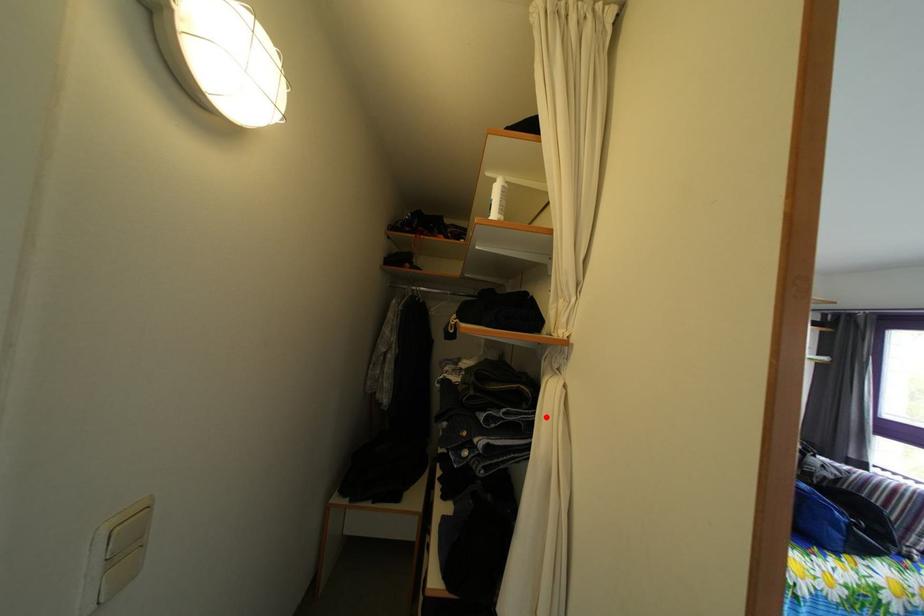
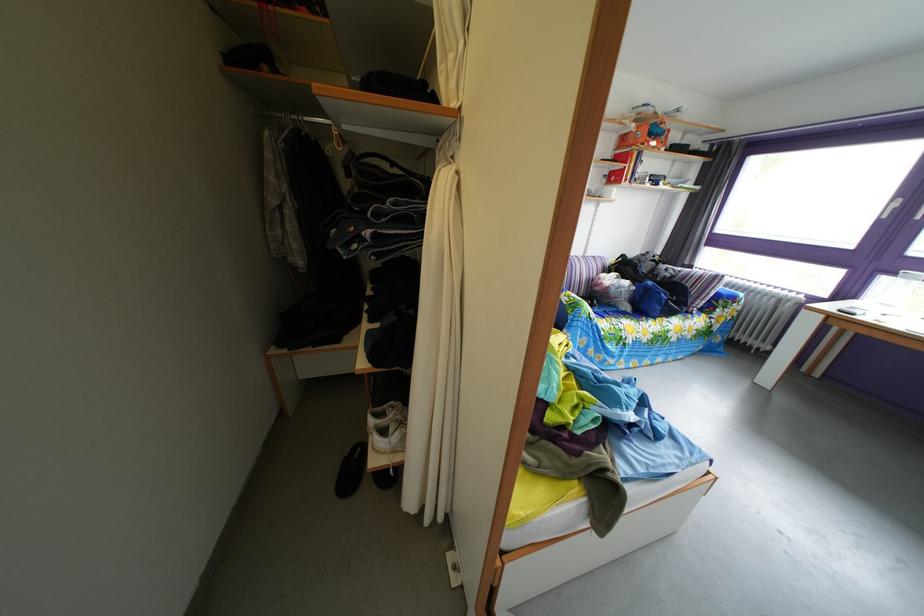
In the second image, find the point that corresponds to the highlighted location in the first image.

(438, 207)